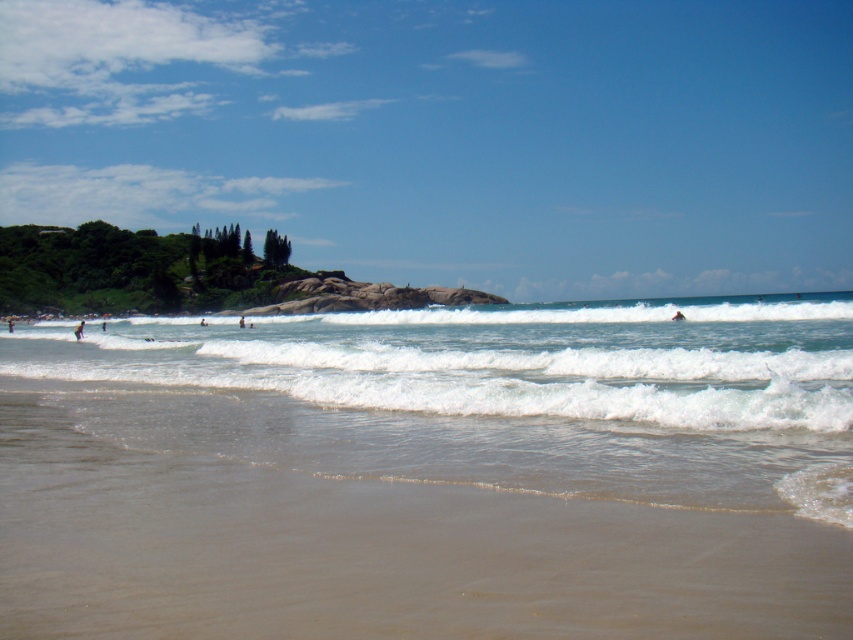
Who is positioned more to the left, clear blue water at center or white surfboard at center?

white surfboard at center is more to the left.

Is the position of clear blue water at center less distant than that of white surfboard at center?

Yes.

Describe the element at coordinates (486, 396) in the screenshot. I see `clear blue water at center` at that location.

The image size is (853, 640). I want to click on clear blue water at center, so click(x=486, y=396).

Is blue fabric surfboard at right above white surfboard at center?

Incorrect, blue fabric surfboard at right is not positioned above white surfboard at center.

Is blue fabric surfboard at right positioned at the back of white surfboard at center?

No, blue fabric surfboard at right is closer to the viewer.

Measure the distance between blue fabric surfboard at right and camera.

34.68 meters

At what (x,y) coordinates should I click in order to perform the action: click on blue fabric surfboard at right. Please return your answer as a coordinate pair (x, y). The height and width of the screenshot is (640, 853). Looking at the image, I should click on (677, 316).

Can you confirm if blue fabric surfboard at right is shorter than dark brown surfboard at left?

Yes, blue fabric surfboard at right is shorter than dark brown surfboard at left.

Is blue fabric surfboard at right bigger than dark brown surfboard at left?

Incorrect, blue fabric surfboard at right is not larger than dark brown surfboard at left.

This screenshot has width=853, height=640. Describe the element at coordinates (677, 316) in the screenshot. I see `blue fabric surfboard at right` at that location.

Image resolution: width=853 pixels, height=640 pixels. I want to click on blue fabric surfboard at right, so click(677, 316).